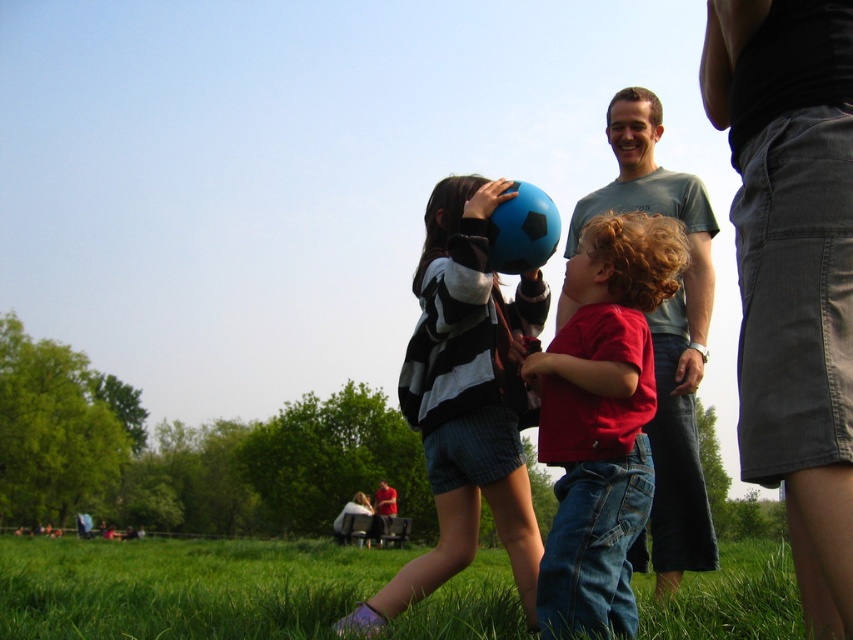
Does point (450, 624) come farther from viewer compared to point (648, 422)?

No, (450, 624) is closer to viewer.

Based on the photo, is green grass at lower center wider than matte gray t-shirt at upper right?

Indeed, green grass at lower center has a greater width compared to matte gray t-shirt at upper right.

Is point (485, 577) positioned after point (683, 332)?

Yes.

I want to click on green grass at lower center, so click(181, 588).

This screenshot has width=853, height=640. In order to click on black cotton skirt at upper right in this screenshot , I will do [793, 269].

Is black cotton skirt at upper right taller than blue rubber ball at center?

No.

Between point (811, 77) and point (677, 428), which one is positioned behind?

Point (677, 428)

Find the location of a particular element. The height and width of the screenshot is (640, 853). black cotton skirt at upper right is located at coordinates (793, 269).

Between green grass at lower center and matte blue ball at center, which one appears on the left side from the viewer's perspective?

Positioned to the left is matte blue ball at center.

Does green grass at lower center appear on the right side of matte blue ball at center?

Yes, green grass at lower center is to the right of matte blue ball at center.

Locate an element on the screen. This screenshot has height=640, width=853. green grass at lower center is located at coordinates (181, 588).